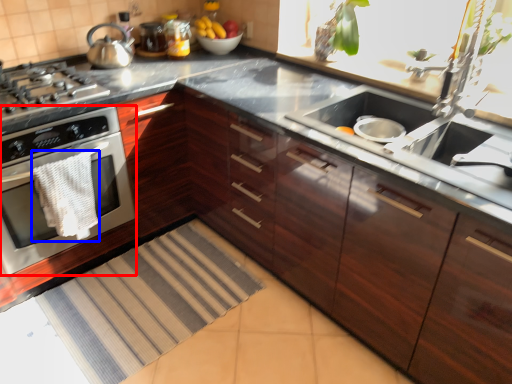
Question: Which object is closer to the camera taking this photo, home appliance (highlighted by a red box) or material (highlighted by a blue box)?

Choices:
 (A) home appliance
 (B) material

Answer: (A)